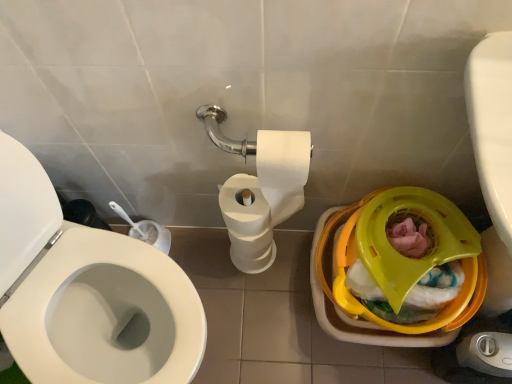
Where is `yellow plastic potty at lower right`? This screenshot has height=384, width=512. yellow plastic potty at lower right is located at coordinates (401, 255).

Describe the element at coordinates (401, 255) in the screenshot. The height and width of the screenshot is (384, 512). I see `yellow plastic potty at lower right` at that location.

Describe the element at coordinates (265, 197) in the screenshot. The width and height of the screenshot is (512, 384). I see `white matte toilet paper at center` at that location.

At what (x,y) coordinates should I click in order to perform the action: click on white matte toilet paper at center. Please return your answer as a coordinate pair (x, y). Looking at the image, I should click on (265, 197).

What is the approximate height of white matte toilet paper at center?

It is 18.40 inches.

Locate an element on the screen. Image resolution: width=512 pixels, height=384 pixels. yellow plastic potty at lower right is located at coordinates (401, 255).

Which object is positioned more to the left, white matte toilet paper at center or yellow plastic potty at lower right?

From the viewer's perspective, white matte toilet paper at center appears more on the left side.

Which object is closer to the camera taking this photo, white matte toilet paper at center or yellow plastic potty at lower right?

yellow plastic potty at lower right.

Which is closer to the camera, (264, 141) or (463, 250)?

Point (264, 141) is positioned closer to the camera compared to point (463, 250).

From the image's perspective, is white matte toilet paper at center over yellow plastic potty at lower right?

Indeed, from the image's perspective, white matte toilet paper at center is shown above yellow plastic potty at lower right.

From a real-world perspective, is white matte toilet paper at center on top of yellow plastic potty at lower right?

Incorrect, from a real-world perspective, white matte toilet paper at center is lower than yellow plastic potty at lower right.

Consider the image. Considering the sizes of objects white matte toilet paper at center and yellow plastic potty at lower right in the image provided, who is wider, white matte toilet paper at center or yellow plastic potty at lower right?

With larger width is yellow plastic potty at lower right.

Considering the sizes of objects white matte toilet paper at center and yellow plastic potty at lower right in the image provided, who is shorter, white matte toilet paper at center or yellow plastic potty at lower right?

Standing shorter between the two is yellow plastic potty at lower right.

Considering the relative sizes of white matte toilet paper at center and yellow plastic potty at lower right in the image provided, is white matte toilet paper at center smaller than yellow plastic potty at lower right?

Yes.

Is white matte toilet paper at center situated inside yellow plastic potty at lower right or outside?

white matte toilet paper at center is spatially situated outside yellow plastic potty at lower right.

Are white matte toilet paper at center and yellow plastic potty at lower right far apart?

No, white matte toilet paper at center is not far from yellow plastic potty at lower right.

Consider the image. Is white matte toilet paper at center turned away from yellow plastic potty at lower right?

No.

Can you tell me how much white matte toilet paper at center and yellow plastic potty at lower right differ in facing direction?

They differ by 0.000699 degrees in their facing directions.

How distant is white matte toilet paper at center from yellow plastic potty at lower right?

white matte toilet paper at center is 10.68 inches away from yellow plastic potty at lower right.

Identify the location of potty located below the white matte toilet paper at center (from the image's perspective). Image resolution: width=512 pixels, height=384 pixels. (401, 255).

Which is more to the right, yellow plastic potty at lower right or white matte toilet paper at center?

Positioned to the right is yellow plastic potty at lower right.

Considering the relative positions of yellow plastic potty at lower right and white matte toilet paper at center in the image provided, is yellow plastic potty at lower right behind white matte toilet paper at center?

No.

In the scene shown: Which is farther from the camera, [393,260] or [263,155]?

The point [393,260] is behind.

From the image's perspective, which is below, yellow plastic potty at lower right or white matte toilet paper at center?

yellow plastic potty at lower right is shown below in the image.

From a real-world perspective, which is physically below, yellow plastic potty at lower right or white matte toilet paper at center?

From a 3D spatial view, white matte toilet paper at center is below.

In terms of width, does yellow plastic potty at lower right look wider or thinner when compared to white matte toilet paper at center?

yellow plastic potty at lower right is wider than white matte toilet paper at center.

Considering the sizes of objects yellow plastic potty at lower right and white matte toilet paper at center in the image provided, who is taller, yellow plastic potty at lower right or white matte toilet paper at center?

Standing taller between the two is white matte toilet paper at center.

Who is bigger, yellow plastic potty at lower right or white matte toilet paper at center?

Bigger between the two is yellow plastic potty at lower right.

Could white matte toilet paper at center be considered to be inside yellow plastic potty at lower right?

No, white matte toilet paper at center is not surrounded by yellow plastic potty at lower right.

Is yellow plastic potty at lower right next to white matte toilet paper at center and touching it?

No, yellow plastic potty at lower right is not next to white matte toilet paper at center.

From the picture: Is yellow plastic potty at lower right oriented away from white matte toilet paper at center?

yellow plastic potty at lower right does not have its back to white matte toilet paper at center.

What's the angular difference between yellow plastic potty at lower right and white matte toilet paper at center's facing directions?

The angular difference between yellow plastic potty at lower right and white matte toilet paper at center is 0.000699 degrees.

How far apart are yellow plastic potty at lower right and white matte toilet paper at center?

yellow plastic potty at lower right and white matte toilet paper at center are 10.68 inches apart.

The height and width of the screenshot is (384, 512). In the image, there is a yellow plastic potty at lower right. What are the coordinates of `toilet paper above it (from the image's perspective)` in the screenshot? It's located at (265, 197).

I want to click on potty above the white matte toilet paper at center (from a real-world perspective), so (401, 255).

The height and width of the screenshot is (384, 512). Identify the location of potty that appears in front of the white matte toilet paper at center. 401,255.